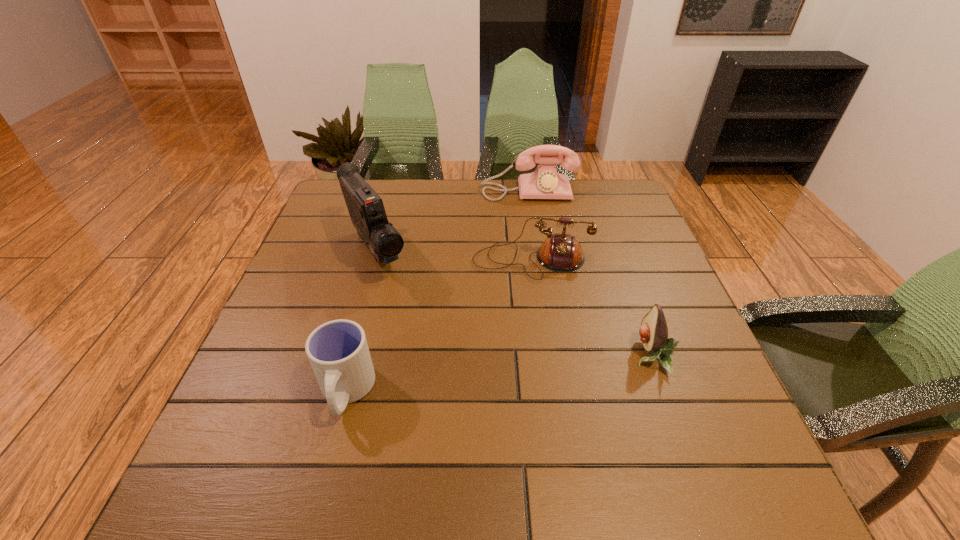
You are a GUI agent. You are given a task and a screenshot of the screen. Output one action in this format:
    pyautogui.click(x=<x>, y=<y>)
    Task: Click on the cup
    
    Given the screenshot: What is the action you would take?
    pyautogui.click(x=338, y=352)

This screenshot has width=960, height=540. I want to click on avocado, so click(654, 332).

In order to click on the taller telephone in this screenshot , I will do `click(545, 182)`.

Locate an element on the screen. The height and width of the screenshot is (540, 960). the second tallest object is located at coordinates tap(545, 182).

Image resolution: width=960 pixels, height=540 pixels. Identify the location of the tallest object. pos(366,209).

The width and height of the screenshot is (960, 540). Find the location of `the nearer telephone`. the nearer telephone is located at coordinates (559, 252).

Locate an element on the screen. free space located on the seed side of the rightmost object is located at coordinates (452, 356).

Identify the location of free space located 0.280m on the seed side of the rightmost object. Image resolution: width=960 pixels, height=540 pixels. (500, 356).

The width and height of the screenshot is (960, 540). In order to click on vacant space located 0.160m on the seed side of the rightmost object in this screenshot , I will do `click(558, 356)`.

The width and height of the screenshot is (960, 540). I want to click on vacant space located 0.340m on the dial of the second tallest object, so click(537, 276).